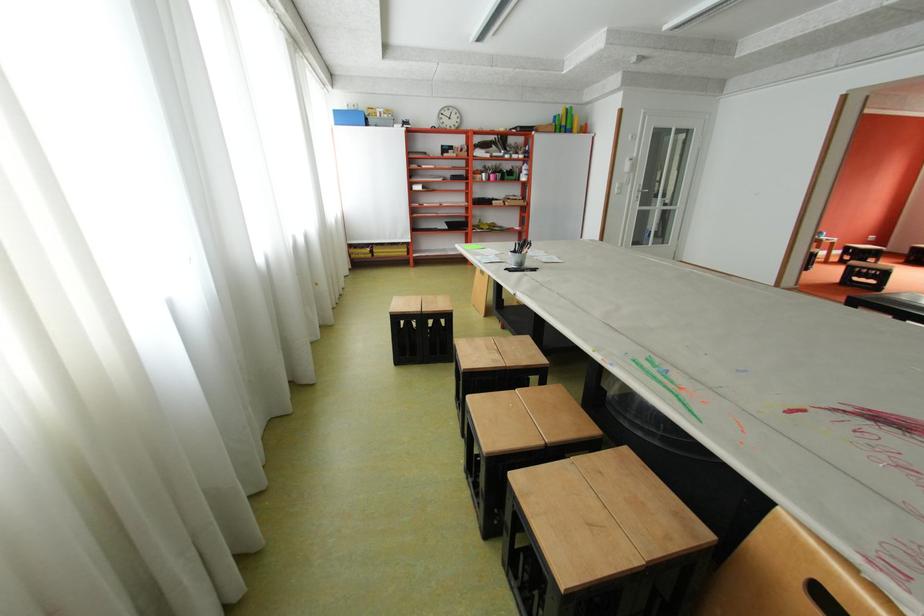
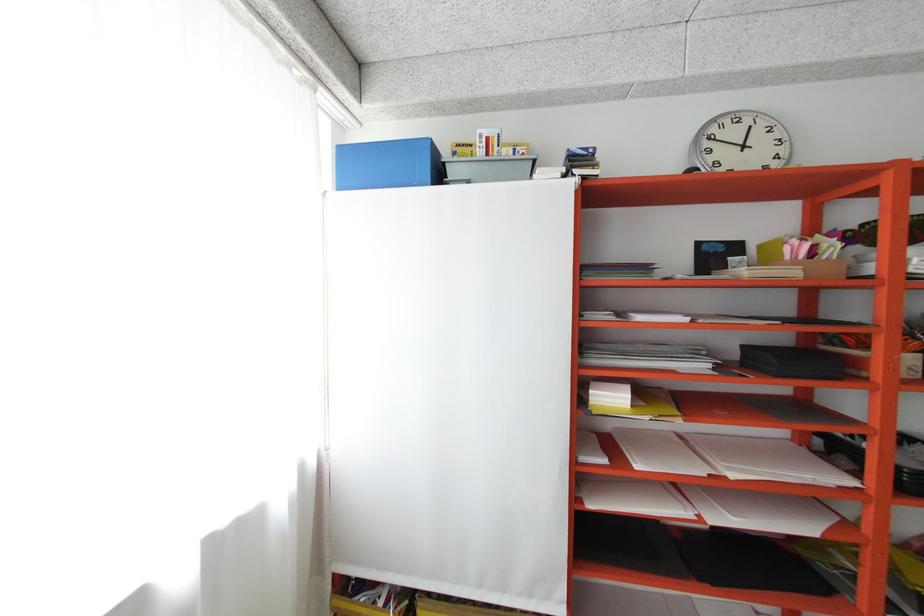
In the second image, find the point that corresponds to (377,114) in the first image.

(456, 156)